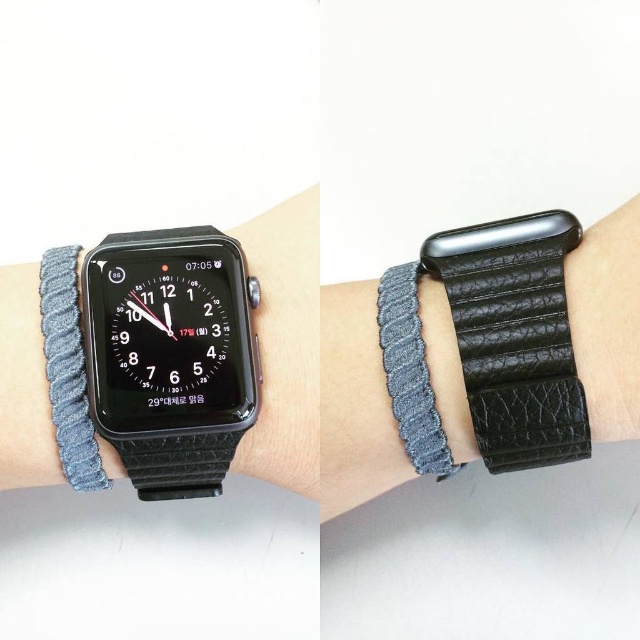
You are trying to decide which watch to wear today. You have a black leather watch at left and a denim woven band at left. If you want to wear the taller one, which should you choose?

The black leather watch at left is much taller than the denim woven band at left, so you should choose the black leather watch at left.

Based on the photo, you are a delivery robot with a height of 36 inches. You are in a room and need to pass through a narrow corridor. The corridor has two obstacles represented by the points at point (x=172, y=317). Can you safely navigate through the corridor without hitting the obstacles?

The two obstacles at point (x=172, y=317) are 36.72 inches apart. Since the robot is 36 inches tall, there is enough space between the obstacles for the robot to pass through safely.

You are trying to choose between two black leather accessories for your outfit. You have the black leather watch at left and the black leather wristband at center. Based on the image, which one is smaller in size?

The black leather watch at left is smaller than the black leather wristband at center.